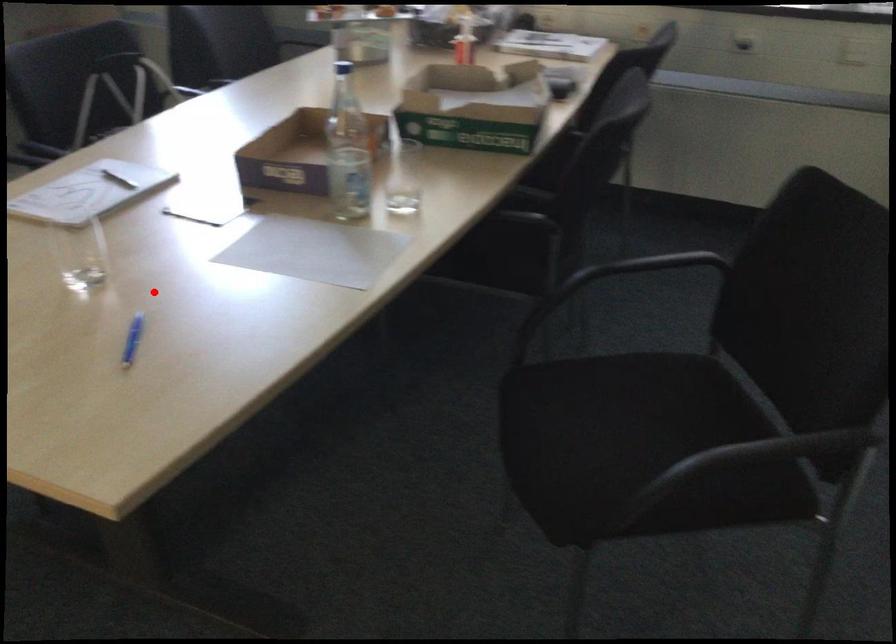
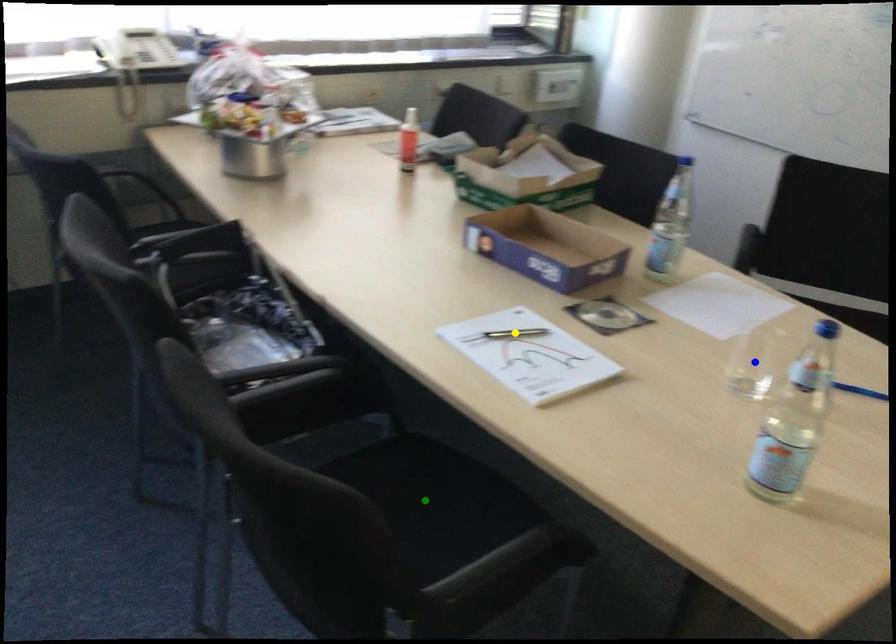
Question: I am providing you with two images of the same scene from different viewpoints. A red point is marked on the first image. You are given multiple points on the second image. Which point in image 2 represents the same 3d spot as the red point in image 1?

Choices:
 (A) yellow point
 (B) blue point
 (C) green point

Answer: (B)